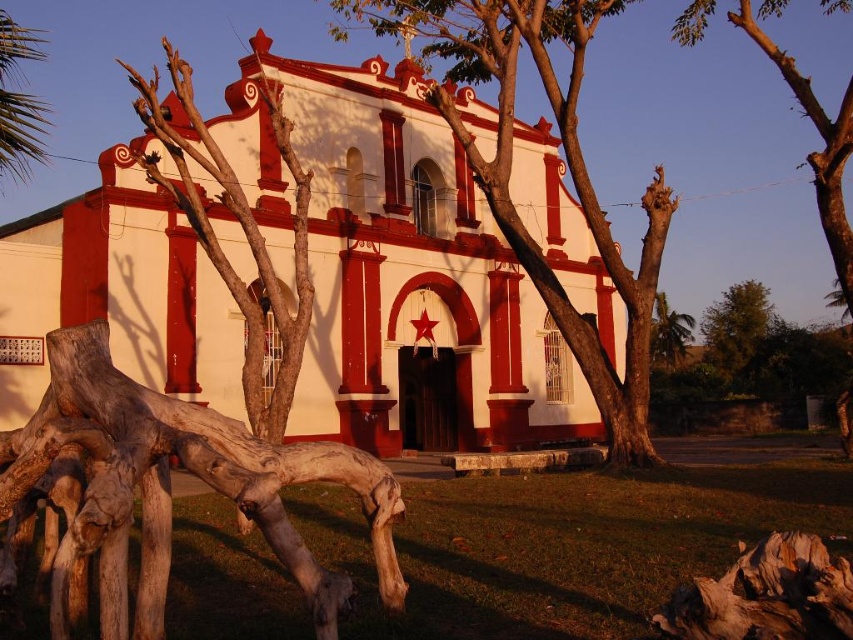
You are standing at the entrance of the traditional building and see a point marked at coordinates (566, 164). What object is located at this point?

The point at (566, 164) marks a smooth bark tree at center.

From the picture: You are standing in front of the traditional building and want to know which of the two green leafy plants, the green leafy palm at upper left or the green leafy tree at right, is taller. Can you determine this based on their positions?

The green leafy palm at upper left is taller than the green leafy tree at right according to their positions in the image.